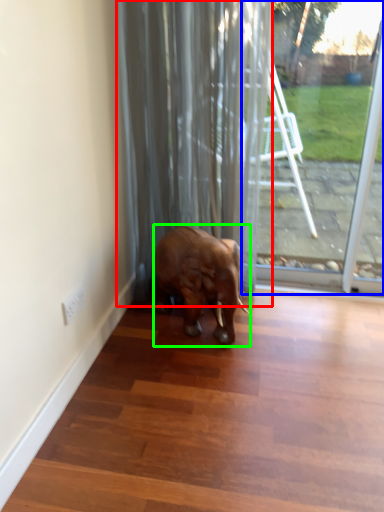
Question: Based on their relative distances, which object is farther from curtain (highlighted by a red box)? Choose from glass door (highlighted by a blue box) and elephant (highlighted by a green box).

Choices:
 (A) glass door
 (B) elephant

Answer: (A)